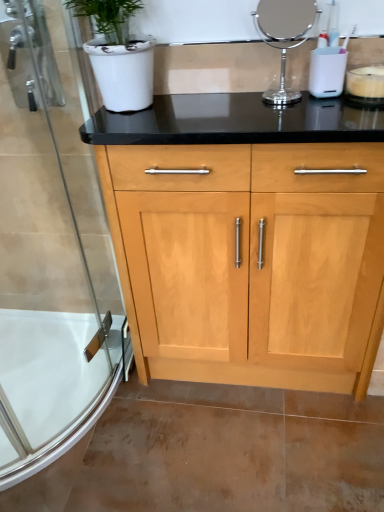
Identify the location of vacant space to the right of clear glass shower door at left. (188, 415).